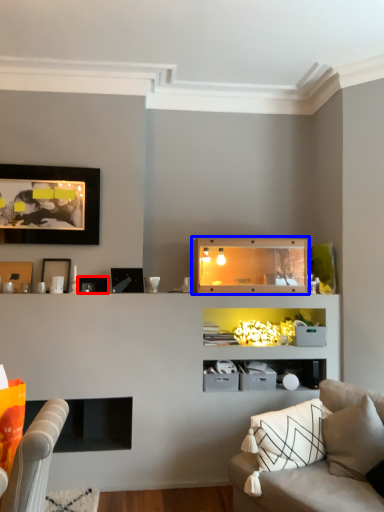
Question: Among these objects, which one is nearest to the camera, picture frame (highlighted by a red box) or shelf (highlighted by a blue box)?

Choices:
 (A) picture frame
 (B) shelf

Answer: (B)